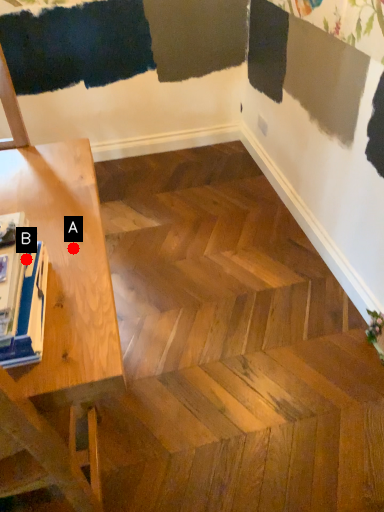
Question: Two points are circled on the image, labeled by A and B beside each circle. Which point is farther to the camera?

Choices:
 (A) A is further
 (B) B is further

Answer: (A)